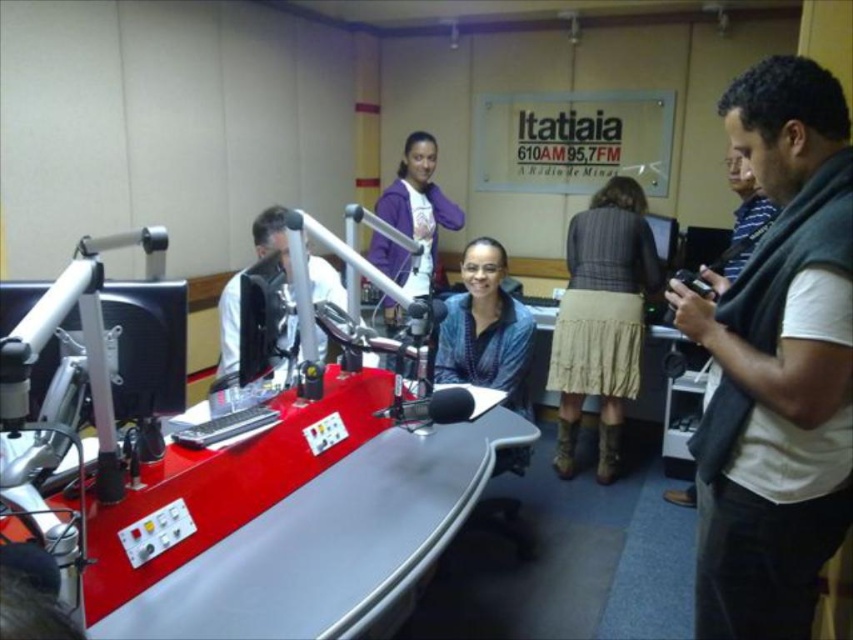
Question: Does striped fabric skirt at center appear over gray striped sweater at right?

Choices:
 (A) no
 (B) yes

Answer: (A)

Question: Which point appears farthest from the camera in this image?

Choices:
 (A) (631, 340)
 (B) (234, 316)
 (C) (799, 412)
 (D) (466, 291)

Answer: (D)

Question: Based on their relative distances, which object is farther from the white shirt at left?

Choices:
 (A) striped fabric skirt at center
 (B) blue textured sweater at center

Answer: (A)

Question: Is gray sweater at right further to the viewer compared to gray striped sweater at right?

Choices:
 (A) no
 (B) yes

Answer: (A)

Question: Considering the real-world distances, which object is closest to the purple fleece jacket at upper center?

Choices:
 (A) blue textured sweater at center
 (B) striped fabric skirt at center

Answer: (B)

Question: Can you confirm if gray sweater at right is positioned to the right of white shirt at left?

Choices:
 (A) no
 (B) yes

Answer: (B)